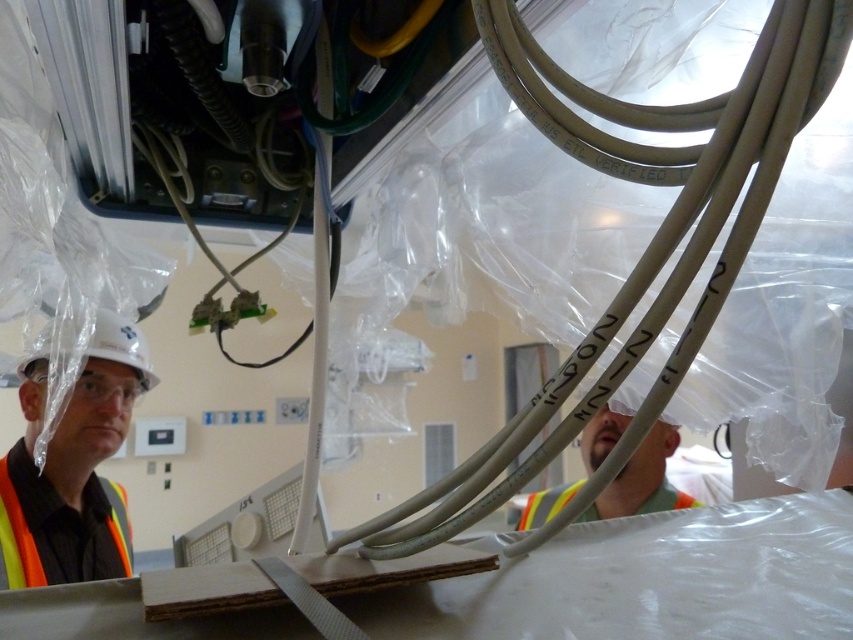
You are a technician working in this workspace. You need to locate the reflective silver helmet at center. Where exactly is it positioned in the scene?

The reflective silver helmet at center is positioned at coordinates point (x=642, y=481) in the scene.

You are standing at the point labeled as point (642, 465) in the workspace. A safety inspector needs to reach you within 2 meters to conduct a quick inspection. Can the inspector reach you without moving beyond the 2 meter limit?

The distance between point (642, 465) and the viewer is exactly 2.04 meters, which is slightly beyond the 2 meter limit. Therefore, the inspector cannot reach you within the required distance without moving slightly further.

You are standing in the workspace and want to move from point A to point B. Point A is at coordinate point (77, 557) and point B is at coordinate point (613, 412). Which point is closer to you?

Point A at coordinate point (77, 557) is closer to you because it is further to the viewer than point B at coordinate point (613, 412).